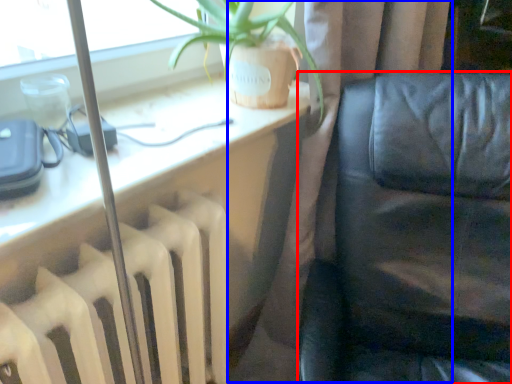
Question: Which object appears farthest to the camera in this image, furniture (highlighted by a red box) or curtain (highlighted by a blue box)?

Choices:
 (A) furniture
 (B) curtain

Answer: (B)